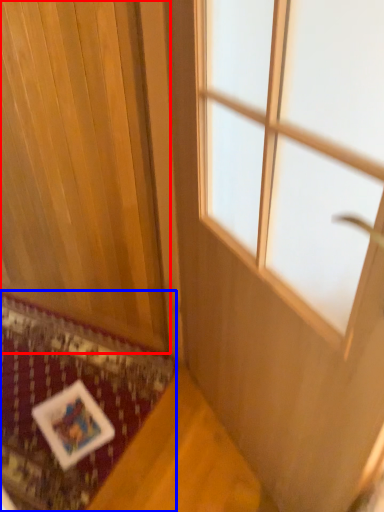
Question: Among these objects, which one is nearest to the camera, curtain (highlighted by a red box) or mat (highlighted by a blue box)?

Choices:
 (A) curtain
 (B) mat

Answer: (A)